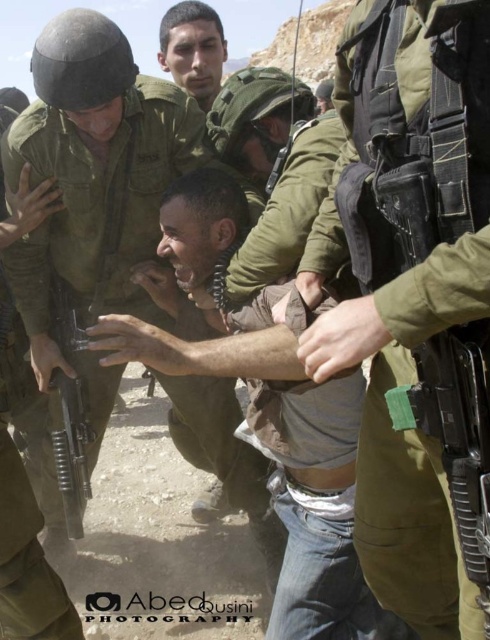
Question: Which of the following is the farthest from the observer?

Choices:
 (A) (481, 291)
 (B) (89, 225)
 (C) (65, 401)

Answer: (B)

Question: Which object is closer to the camera taking this photo?

Choices:
 (A) green fabric uniform at center
 (B) green matte uniform at center
 (C) matte black rifle at center

Answer: (A)

Question: Does green matte uniform at center come in front of matte black rifle at center?

Choices:
 (A) yes
 (B) no

Answer: (B)

Question: Considering the relative positions of green matte uniform at center and matte black rifle at center in the image provided, where is green matte uniform at center located with respect to matte black rifle at center?

Choices:
 (A) above
 (B) below

Answer: (A)

Question: Among these points, which one is nearest to the camera?

Choices:
 (A) (59, 451)
 (B) (49, 161)

Answer: (A)

Question: Is green fabric uniform at center below green matte uniform at center?

Choices:
 (A) no
 (B) yes

Answer: (B)